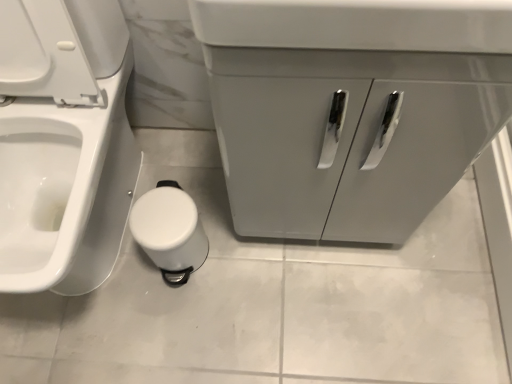
Locate an element on the screen. vacant space positioned to the left of matte gray cabinet at center is located at coordinates (197, 210).